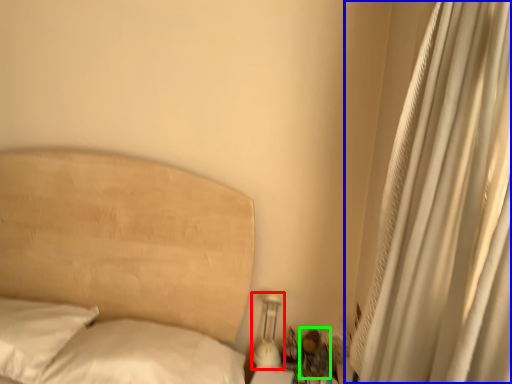
Question: Considering the real-world distances, which object is closest to bedside lamp (highlighted by a red box)? curtain (highlighted by a blue box) or miniature (highlighted by a green box).

Choices:
 (A) curtain
 (B) miniature

Answer: (B)